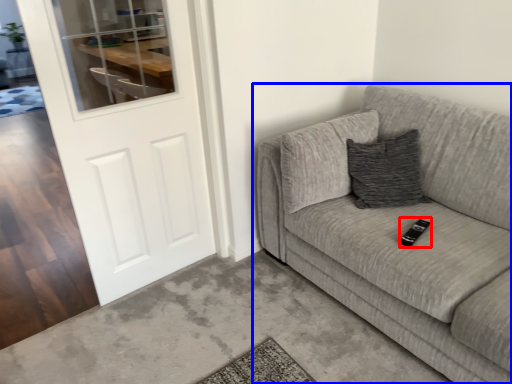
Question: Which of the following is the closest to the observer, remote (highlighted by a red box) or studio couch (highlighted by a blue box)?

Choices:
 (A) remote
 (B) studio couch

Answer: (B)